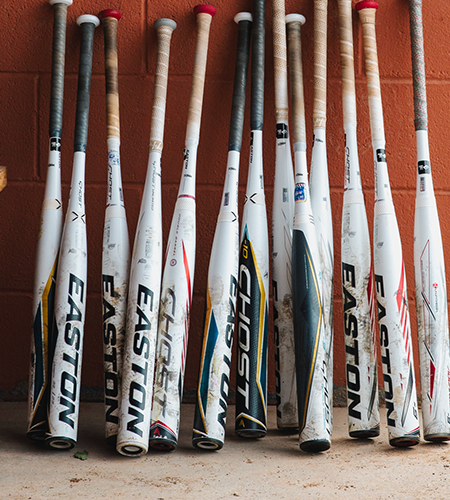
Locate an element on the screen. The width and height of the screenshot is (450, 500). white handle is located at coordinates (69, 2), (91, 18), (239, 14), (294, 16).